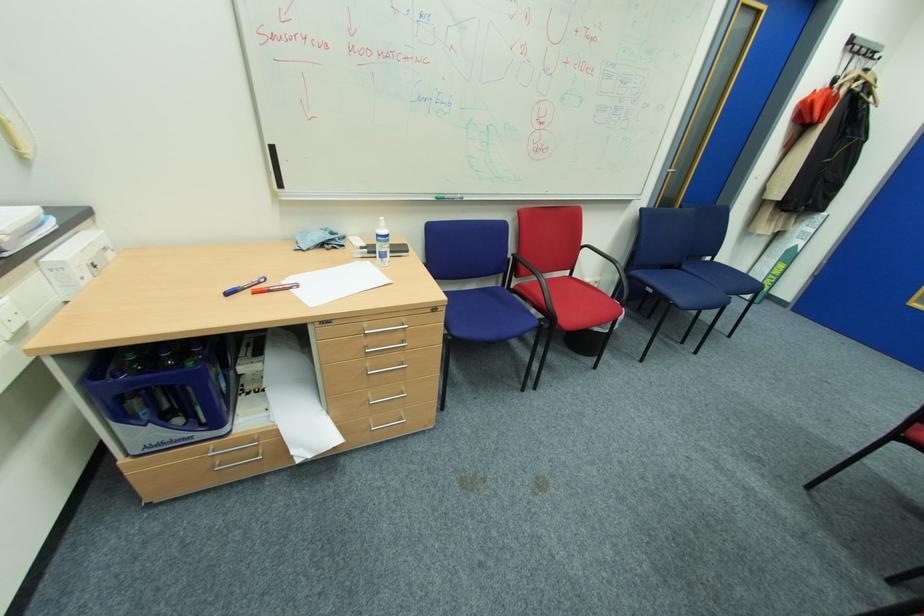
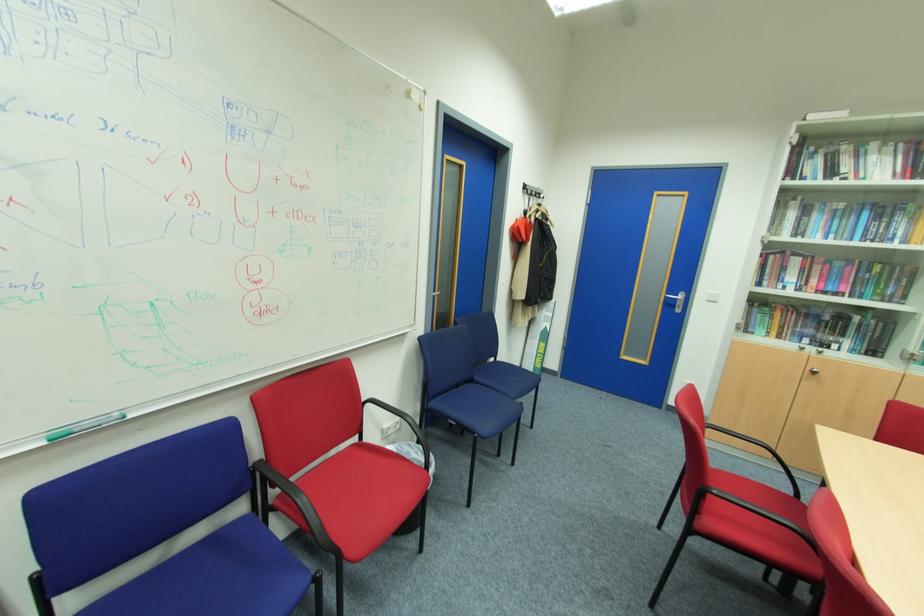
Find the pixel in the second image that matches (520,277) in the first image.

(277, 485)